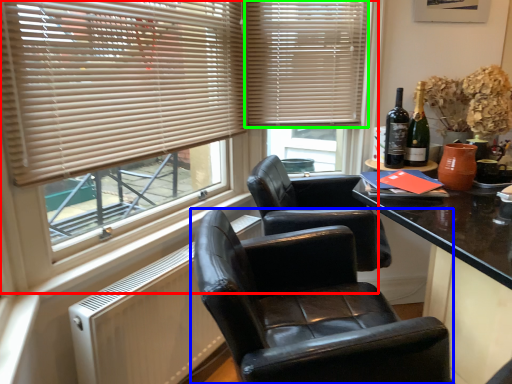
Question: Considering the real-world distances, which object is closest to window (highlighted by a red box)? chair (highlighted by a blue box) or window blind (highlighted by a green box).

Choices:
 (A) chair
 (B) window blind

Answer: (B)